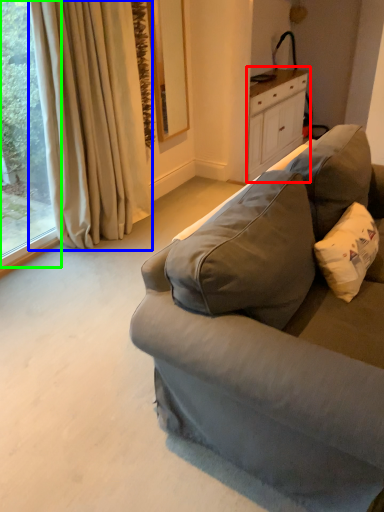
Question: Based on their relative distances, which object is nearer to cabinetry (highlighted by a red box)? Choose from curtain (highlighted by a blue box) and window (highlighted by a green box).

Choices:
 (A) curtain
 (B) window

Answer: (A)